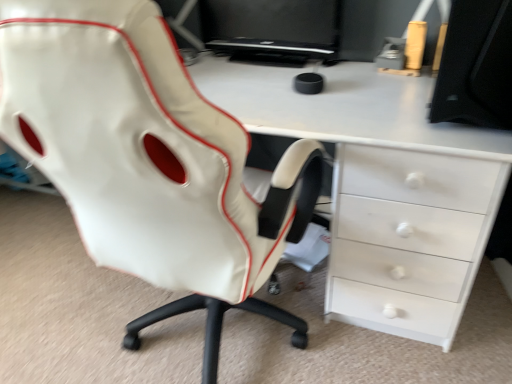
Question: Is black matte monitor at upper right taller than black glossy monitor at upper center?

Choices:
 (A) no
 (B) yes

Answer: (B)

Question: Considering the relative sizes of black matte monitor at upper right and black glossy monitor at upper center in the image provided, is black matte monitor at upper right thinner than black glossy monitor at upper center?

Choices:
 (A) yes
 (B) no

Answer: (B)

Question: From a real-world perspective, does black matte monitor at upper right sit lower than black glossy monitor at upper center?

Choices:
 (A) no
 (B) yes

Answer: (A)

Question: Is black matte monitor at upper right bigger than black glossy monitor at upper center?

Choices:
 (A) yes
 (B) no

Answer: (A)

Question: Does black matte monitor at upper right lie in front of black glossy monitor at upper center?

Choices:
 (A) yes
 (B) no

Answer: (A)

Question: From the image's perspective, relative to black matte monitor at upper right, is white leather chair at center above or below?

Choices:
 (A) above
 (B) below

Answer: (B)

Question: Is point (202, 215) positioned closer to the camera than point (492, 96)?

Choices:
 (A) closer
 (B) farther

Answer: (A)

Question: In terms of size, does white leather chair at center appear bigger or smaller than black matte monitor at upper right?

Choices:
 (A) big
 (B) small

Answer: (A)

Question: Is white leather chair at center situated inside black matte monitor at upper right or outside?

Choices:
 (A) inside
 (B) outside

Answer: (B)

Question: From the image's perspective, relative to black matte monitor at upper right, is white glossy desk at center above or below?

Choices:
 (A) below
 (B) above

Answer: (A)

Question: From a real-world perspective, is white glossy desk at center physically located above or below black matte monitor at upper right?

Choices:
 (A) below
 (B) above

Answer: (A)

Question: Considering the positions of white glossy desk at center and black matte monitor at upper right in the image, is white glossy desk at center wider or thinner than black matte monitor at upper right?

Choices:
 (A) thin
 (B) wide

Answer: (B)

Question: Considering the positions of point (337, 140) and point (505, 16), is point (337, 140) closer or farther from the camera than point (505, 16)?

Choices:
 (A) closer
 (B) farther

Answer: (B)

Question: In terms of height, does black glossy monitor at upper center look taller or shorter compared to black matte monitor at upper right?

Choices:
 (A) tall
 (B) short

Answer: (B)

Question: Looking at their shapes, would you say black glossy monitor at upper center is wider or thinner than black matte monitor at upper right?

Choices:
 (A) thin
 (B) wide

Answer: (A)